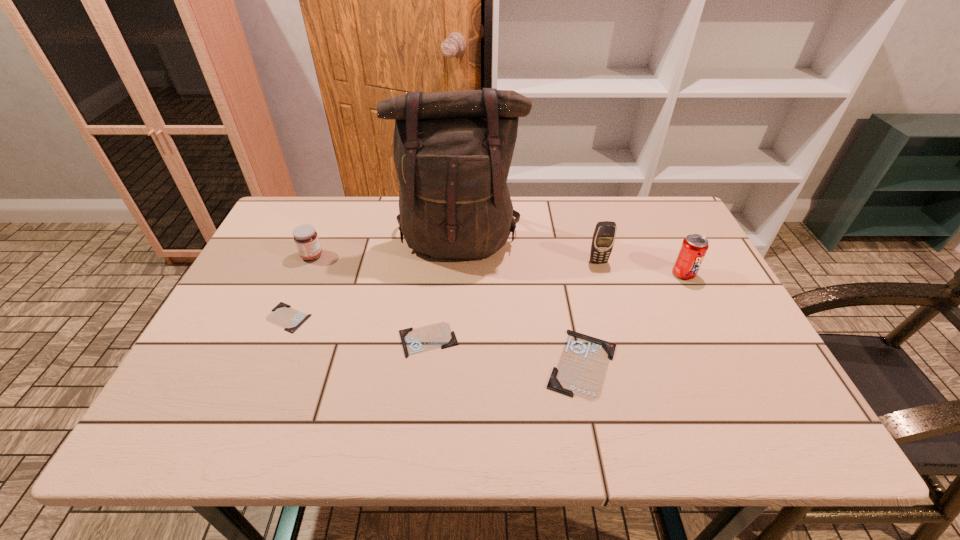
The image size is (960, 540). In order to click on identity card present at the left edge in this screenshot , I will do `click(283, 315)`.

The height and width of the screenshot is (540, 960). I want to click on jam present at the left edge, so click(306, 239).

Locate an element on the screen. object situated at the right edge is located at coordinates (694, 247).

The width and height of the screenshot is (960, 540). Find the location of `vacant region at the far edge`. vacant region at the far edge is located at coordinates (623, 207).

Image resolution: width=960 pixels, height=540 pixels. I want to click on free space at the near edge, so click(468, 368).

Locate an element on the screen. free space at the left edge of the desktop is located at coordinates (274, 292).

This screenshot has width=960, height=540. Identify the location of vacant space at the right edge. pyautogui.click(x=677, y=279).

Where is `vacant space at the far right corner of the desktop`? The width and height of the screenshot is (960, 540). vacant space at the far right corner of the desktop is located at coordinates click(639, 218).

Identify the location of vacant area between the leftmost identity card and the second shortest identity card. The height and width of the screenshot is (540, 960). (358, 328).

Where is `vacant region between the second tallest identity card and the cellular telephone`? vacant region between the second tallest identity card and the cellular telephone is located at coordinates (514, 300).